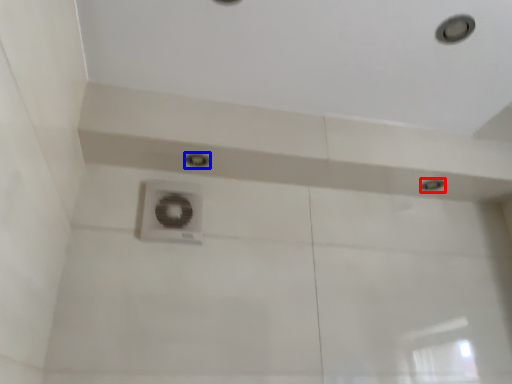
Question: Which point is further to the camera, droplight (highlighted by a red box) or droplight (highlighted by a blue box)?

Choices:
 (A) droplight
 (B) droplight

Answer: (A)